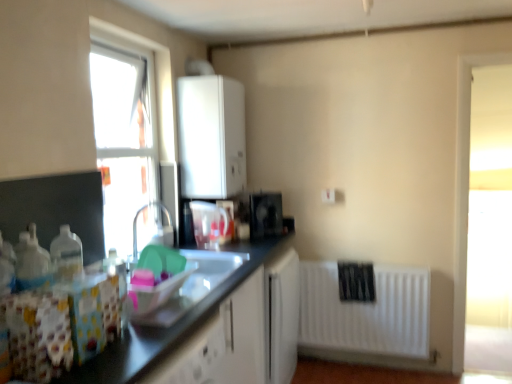
Question: Are white matte boiler at upper center and white matte radiator at lower right far apart?

Choices:
 (A) yes
 (B) no

Answer: (A)

Question: From the image's perspective, is white matte boiler at upper center above white matte radiator at lower right?

Choices:
 (A) no
 (B) yes

Answer: (B)

Question: Can you confirm if white matte boiler at upper center is positioned to the right of white matte radiator at lower right?

Choices:
 (A) yes
 (B) no

Answer: (B)

Question: Could you tell me if white matte boiler at upper center is facing white matte radiator at lower right?

Choices:
 (A) yes
 (B) no

Answer: (B)

Question: Is white matte boiler at upper center located outside white matte radiator at lower right?

Choices:
 (A) no
 (B) yes

Answer: (B)

Question: From a real-world perspective, relative to white matte boiler at upper center, is transparent glass window at upper left vertically above or below?

Choices:
 (A) below
 (B) above

Answer: (A)

Question: Is transparent glass window at upper left inside the boundaries of white matte boiler at upper center, or outside?

Choices:
 (A) inside
 (B) outside

Answer: (B)

Question: Would you say transparent glass window at upper left is to the left or to the right of white matte boiler at upper center in the picture?

Choices:
 (A) right
 (B) left

Answer: (B)

Question: In terms of width, does transparent glass window at upper left look wider or thinner when compared to white matte boiler at upper center?

Choices:
 (A) thin
 (B) wide

Answer: (A)

Question: From a real-world perspective, is white matte boiler at upper center above or below translucent plastic container at center, the first appliance when ordered from front to back?

Choices:
 (A) above
 (B) below

Answer: (A)

Question: Is white matte boiler at upper center bigger or smaller than translucent plastic container at center, which appears as the 2th appliance when viewed from the right?

Choices:
 (A) big
 (B) small

Answer: (A)

Question: Relative to translucent plastic container at center, which is counted as the 2th appliance, starting from the back, is white matte boiler at upper center in front or behind?

Choices:
 (A) behind
 (B) front

Answer: (A)

Question: Considering the positions of point (192, 160) and point (206, 205), is point (192, 160) closer or farther from the camera than point (206, 205)?

Choices:
 (A) farther
 (B) closer

Answer: (A)

Question: Is transparent glass window at upper left in front of or behind translucent plastic container at center, which ranks as the 1th appliance in left-to-right order, in the image?

Choices:
 (A) behind
 (B) front

Answer: (B)

Question: Based on their positions, is transparent glass window at upper left located to the left or right of translucent plastic container at center, the first appliance when ordered from front to back?

Choices:
 (A) left
 (B) right

Answer: (A)